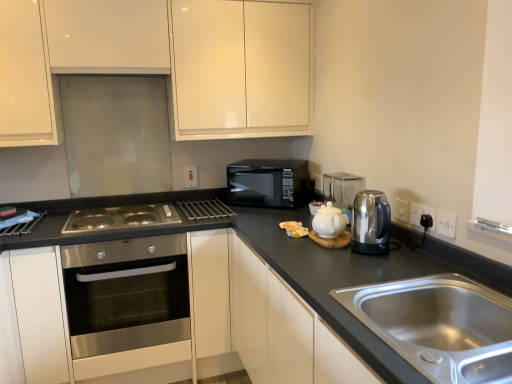
Where is `vacant region below white glossy tea pot at center (from a real-world perspective)`? The width and height of the screenshot is (512, 384). vacant region below white glossy tea pot at center (from a real-world perspective) is located at coordinates [x=332, y=241].